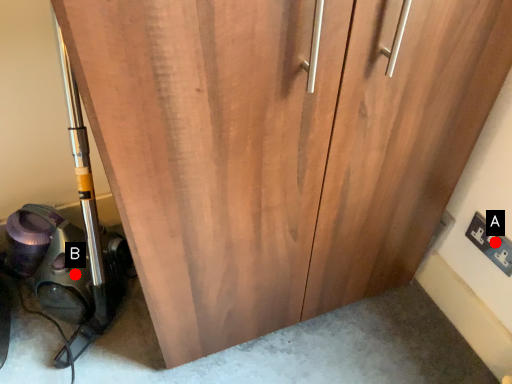
Question: Two points are circled on the image, labeled by A and B beside each circle. Which point appears farthest from the camera in this image?

Choices:
 (A) A is further
 (B) B is further

Answer: (B)